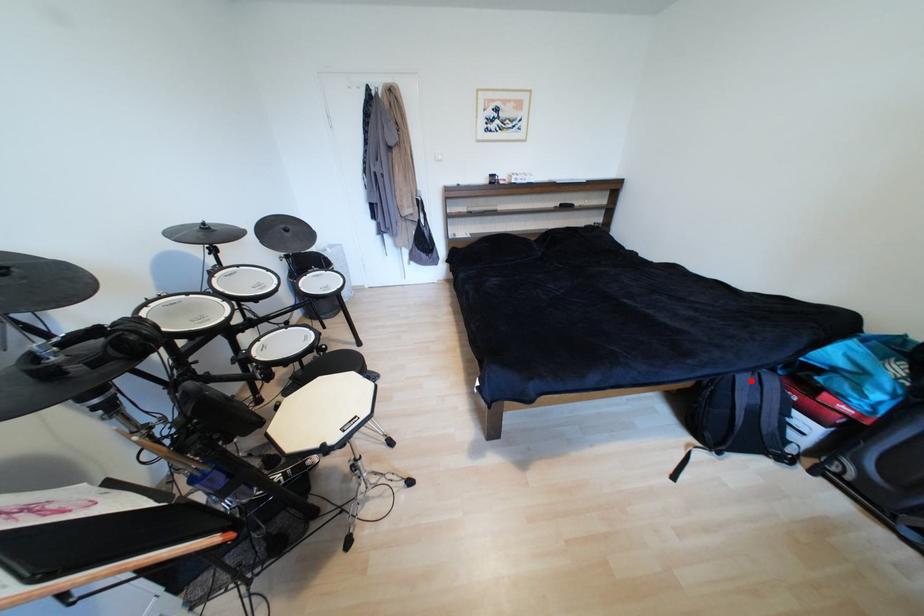
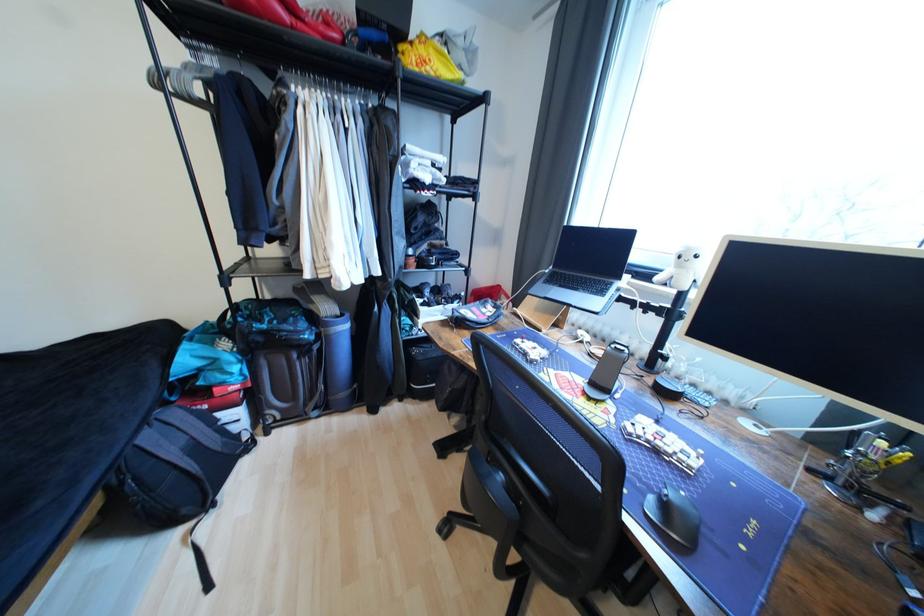
Find the pixel in the second image that matches the highlighted location in the first image.

(155, 439)